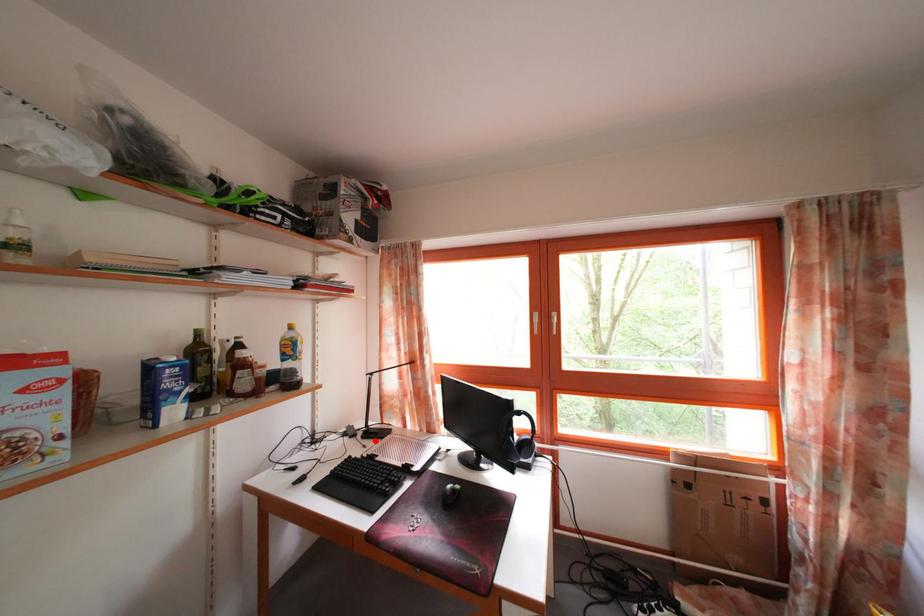
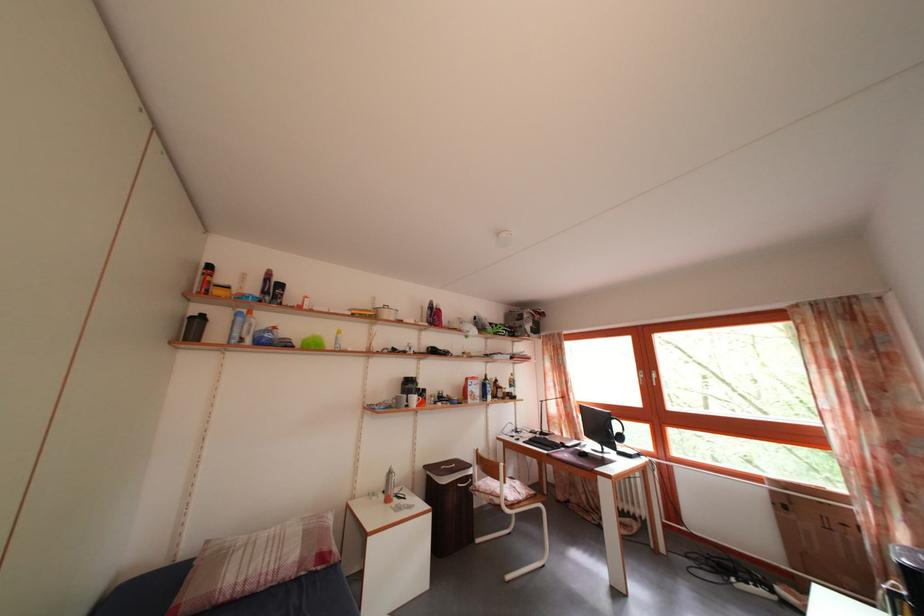
Question: I am providing you with two images of the same scene from different viewpoints. A red point is shown in image1. For the corresponding object point in image2, is it positioned nearer or farther from the camera?

Choices:
 (A) Nearer
 (B) Farther

Answer: (B)